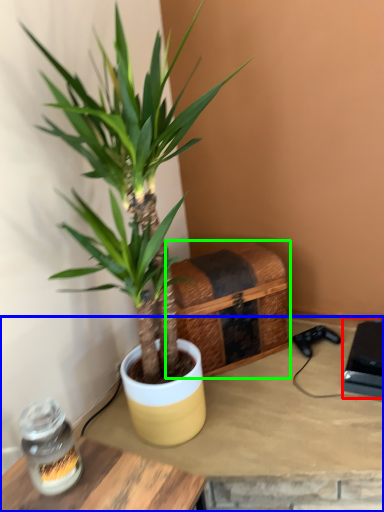
Question: Which object is the closest to the box (highlighted by a red box)? Choose among these: table (highlighted by a blue box) or crate (highlighted by a green box).

Choices:
 (A) table
 (B) crate

Answer: (A)